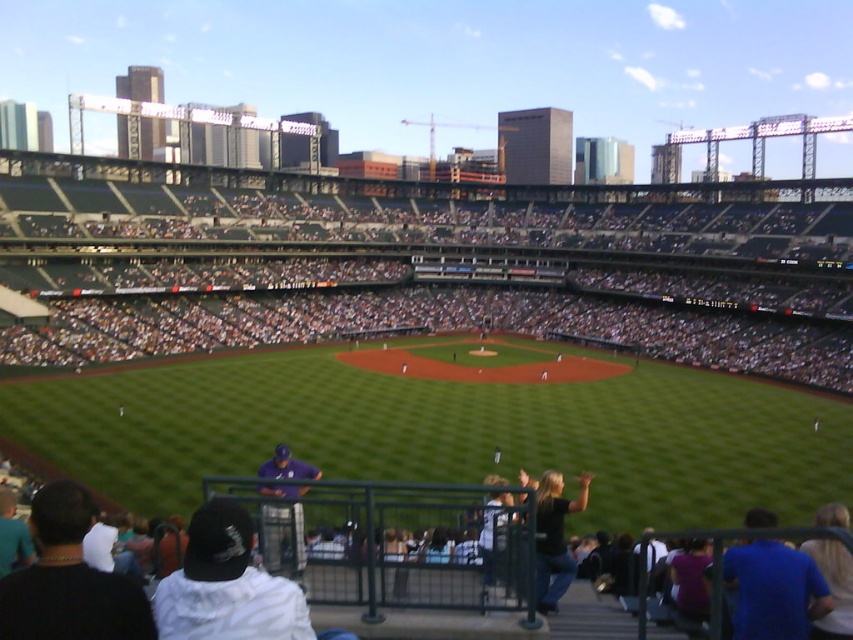
You are standing at the position of the viewer in the stadium and want to throw a baseball to the dark blue baseball cap at lower left. Is the distance within the typical throwing range of an average adult?

The distance between you and the dark blue baseball cap at lower left is 22.00 meters. The typical throwing range for an average adult is around 15 meters, so it is unlikely you can reach that distance.

You are a photographer trying to capture a candid shot of the fan wearing the dark blue baseball cap at lower left and the black leather jacket at lower center. Since you want to ensure both subjects are fully visible in the frame, which object should you focus on to avoid cropping either of them?

The black leather jacket at lower center occupies more space than the dark blue baseball cap at lower left, so focusing on the black leather jacket at lower center would ensure both subjects are fully visible without cropping.

You are a photographer standing at the edge of the field in the stadium. You want to take a photo of the dark blue baseball cap at lower left and the white fabric cap at lower left. The minimum distance your camera can focus on two objects is 3 meters. Will both caps be in focus?

The dark blue baseball cap at lower left is 2.72 meters from the white fabric cap at lower left. Since the distance between them is less than 3 meters, the camera might not be able to focus on both simultaneously. Adjust your position or use a different lens to ensure both are in focus.